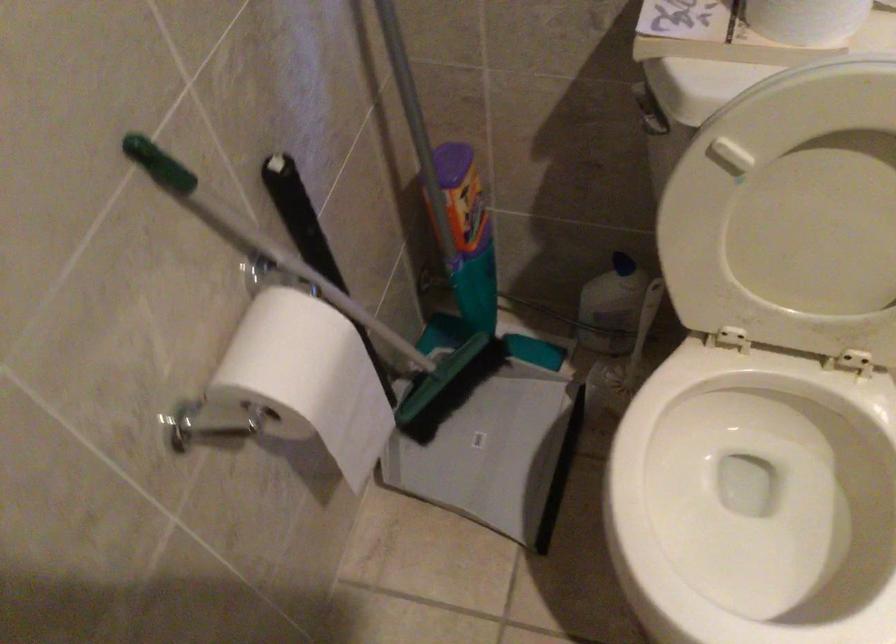
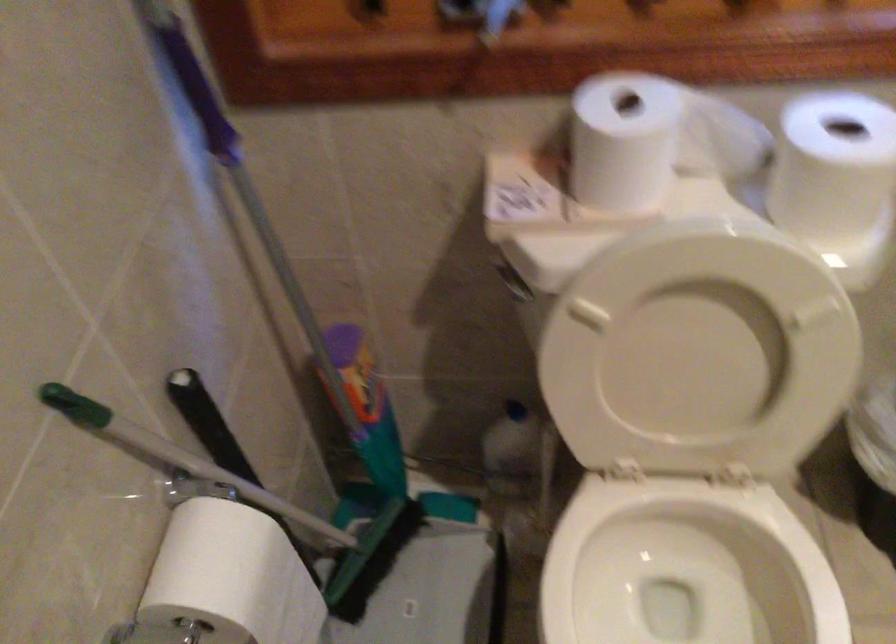
In the second image, find the point that corresponds to (x=300, y=368) in the first image.

(231, 576)